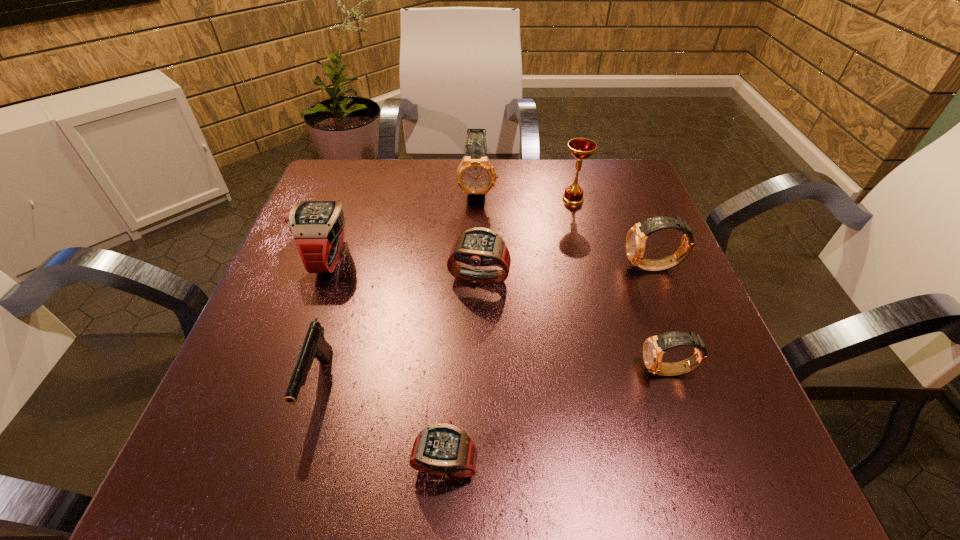
Where is `vacant area that lies between the pistol and the chalice`? The width and height of the screenshot is (960, 540). vacant area that lies between the pistol and the chalice is located at coordinates (445, 292).

Identify the location of unoccupied area between the pistol and the shortest watch. [382, 425].

Where is `free spot between the pistol and the biggest red watch`? The image size is (960, 540). free spot between the pistol and the biggest red watch is located at coordinates (323, 322).

The image size is (960, 540). What are the coordinates of `empty space between the second biggest red watch and the second farthest gold watch` in the screenshot? It's located at (566, 274).

Where is `free space between the biggest red watch and the shortest object`? free space between the biggest red watch and the shortest object is located at coordinates (386, 361).

At what (x,y) coordinates should I click in order to perform the action: click on free space that is in between the pistol and the second smallest red watch. Please return your answer as a coordinate pair (x, y). The image size is (960, 540). Looking at the image, I should click on (398, 333).

Where is `free space between the nearest watch and the second nearest gold watch`? This screenshot has height=540, width=960. free space between the nearest watch and the second nearest gold watch is located at coordinates (549, 366).

Identify which object is located as the third nearest to the second smallest red watch. Please provide its 2D coordinates. Your answer should be formatted as a tuple, i.e. [(x, y)], where the tuple contains the x and y coordinates of a point satisfying the conditions above.

[(315, 346)]

Locate which object is the second closest to the fifth farthest watch. Please provide its 2D coordinates. Your answer should be formatted as a tuple, i.e. [(x, y)], where the tuple contains the x and y coordinates of a point satisfying the conditions above.

[(479, 246)]

Where is `the third closest watch to the farthest watch`? the third closest watch to the farthest watch is located at coordinates (636, 237).